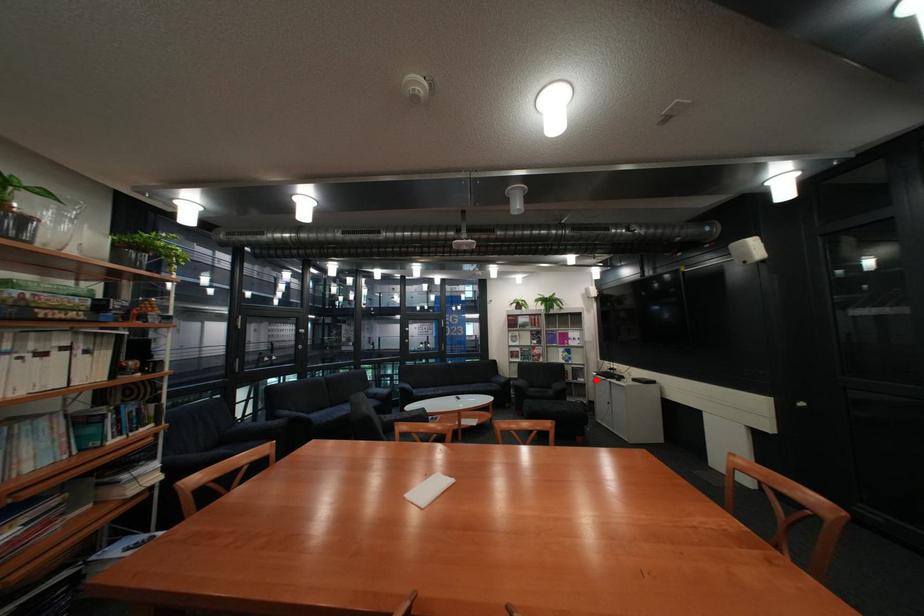
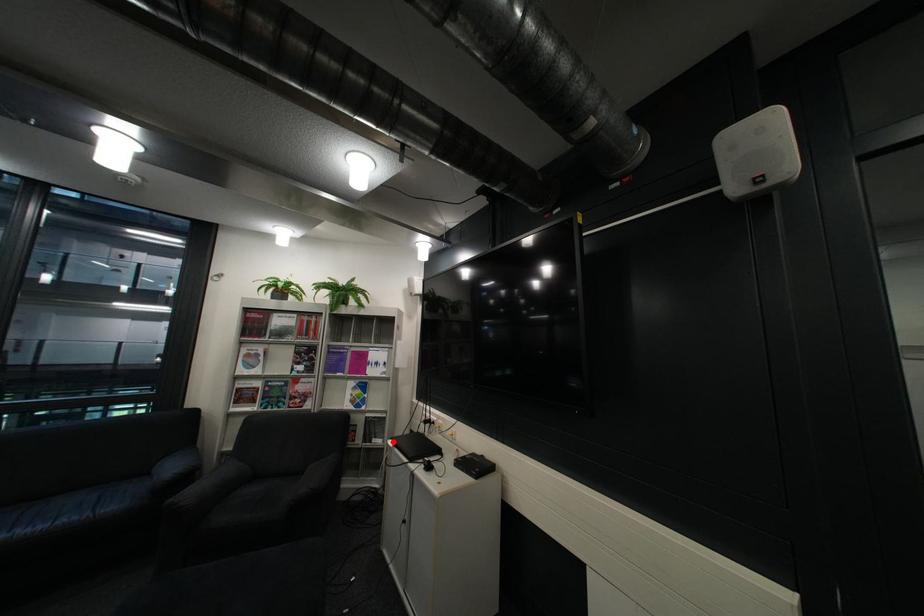
I am providing you with two images of the same scene from different viewpoints. A red point is marked on the first image and another point is marked on the second image. Is the red point in image1 aligned with the point shown in image2?

Yes